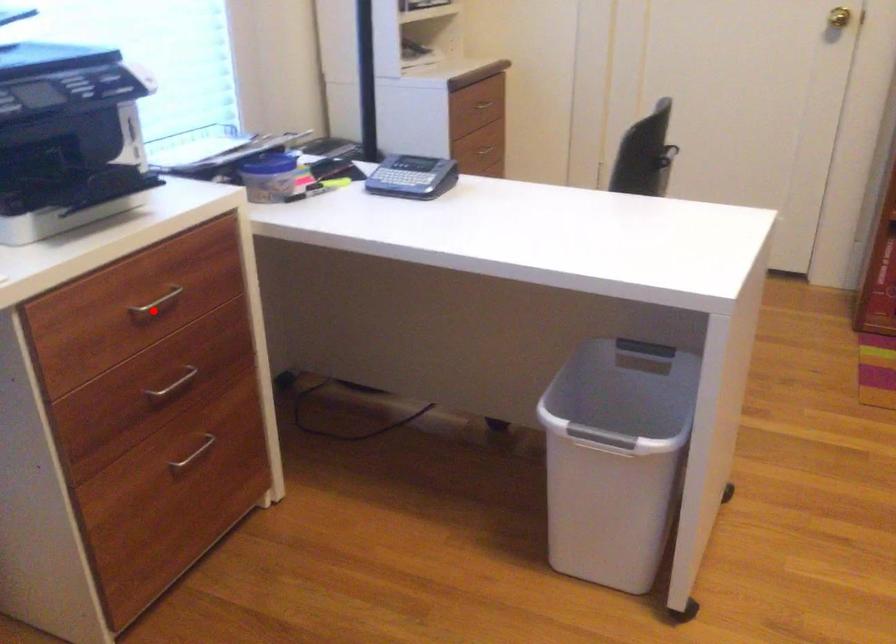
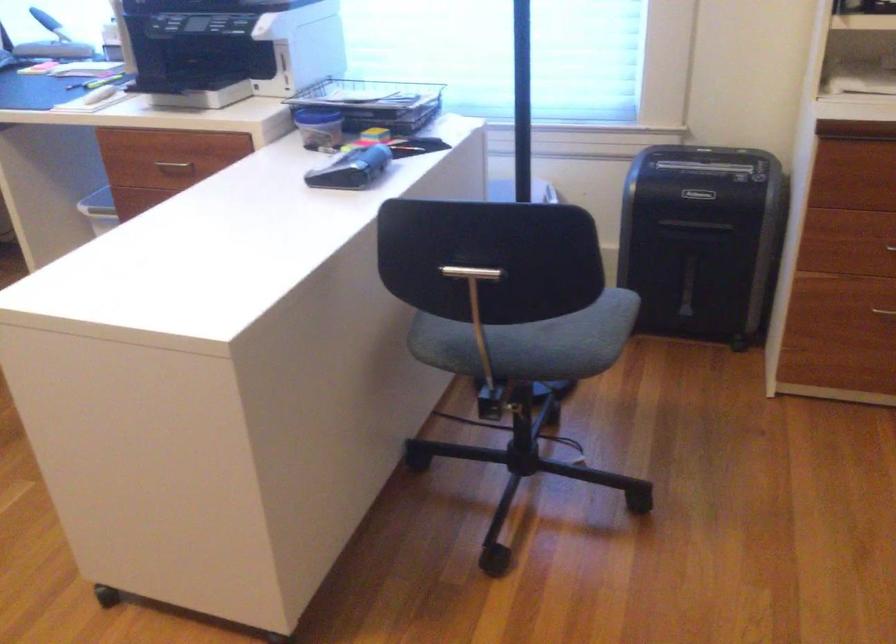
Question: I am providing you with two images of the same scene from different viewpoints. A red point is marked on the first image. Can you still see the location of the red point in image 2?

Choices:
 (A) Yes
 (B) No

Answer: (A)